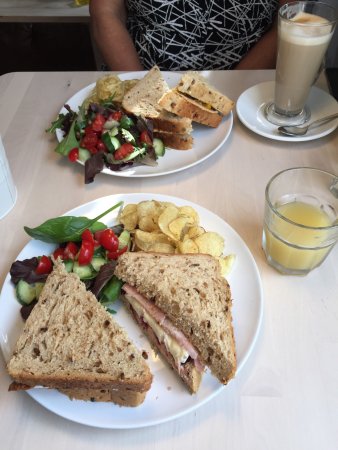
You are a GUI agent. You are given a task and a screenshot of the screen. Output one action in this format:
    pyautogui.click(x=<x>, y=<y>)
    Task: Click on the 1 glass cup with yellow liquid
    
    Given the screenshot: What is the action you would take?
    pyautogui.click(x=282, y=259)